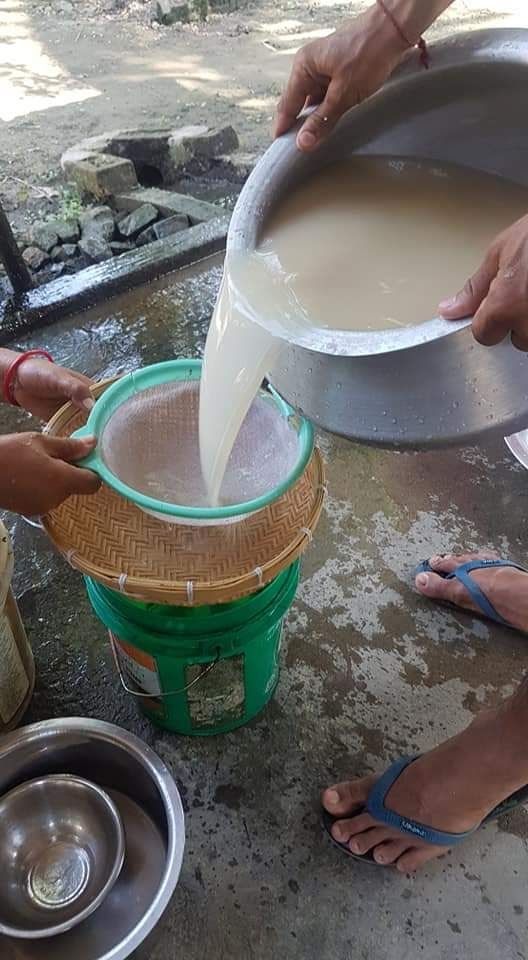
Where is `stainless steel bowl`? The width and height of the screenshot is (528, 960). stainless steel bowl is located at coordinates point(164,824), point(98,835), point(408,388).